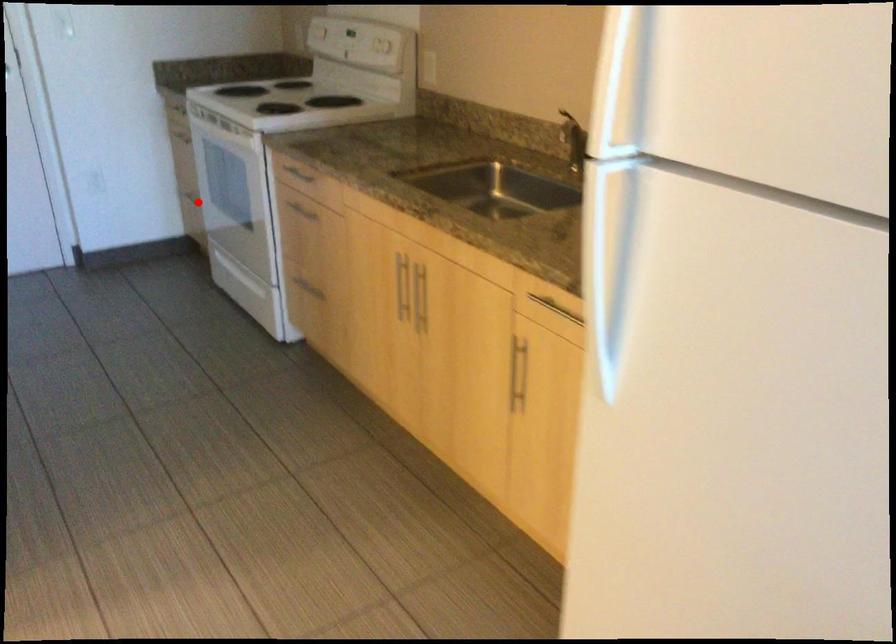
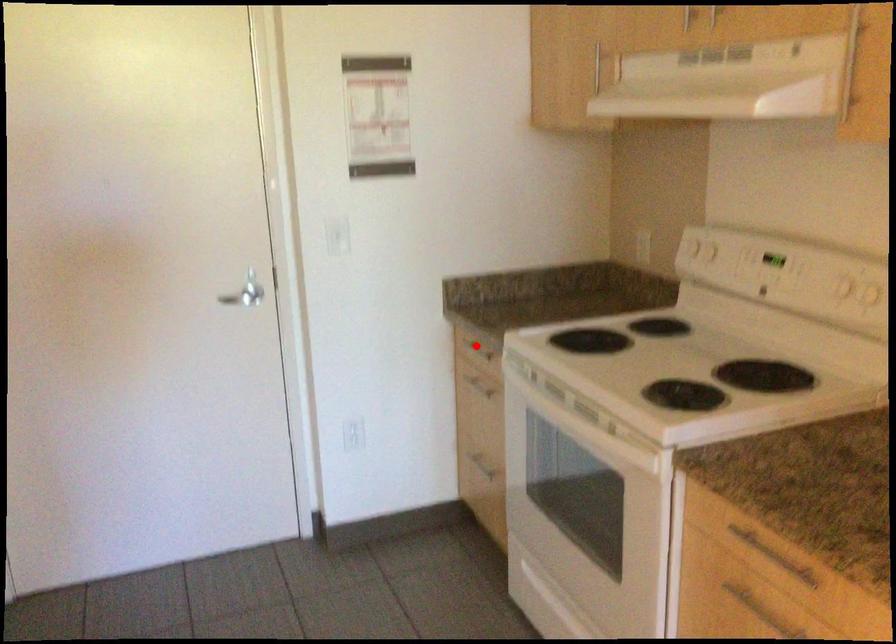
I am providing you with two images of the same scene from different viewpoints. A red point is marked on the first image and another point is marked on the second image. Do the highlighted points in image1 and image2 indicate the same real-world spot?

No